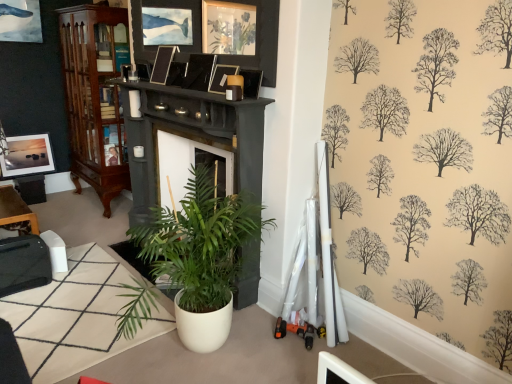
The width and height of the screenshot is (512, 384). In order to click on empty space that is ontop of white matte rug at lower left (from a real-world perspective) in this screenshot , I will do `click(71, 301)`.